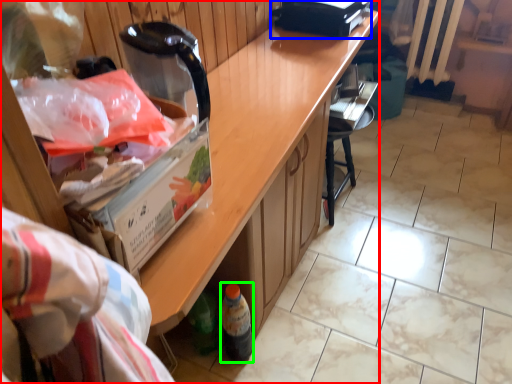
Question: Considering the real-world distances, which object is closest to cabinetry (highlighted by a red box)? appliance (highlighted by a blue box) or bottle (highlighted by a green box).

Choices:
 (A) appliance
 (B) bottle

Answer: (B)